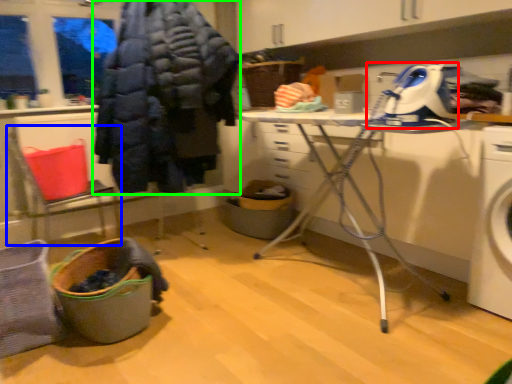
Question: Considering the real-world distances, which object is farthest from sewing machine (highlighted by a red box)? chair (highlighted by a blue box) or clothing (highlighted by a green box)?

Choices:
 (A) chair
 (B) clothing

Answer: (A)